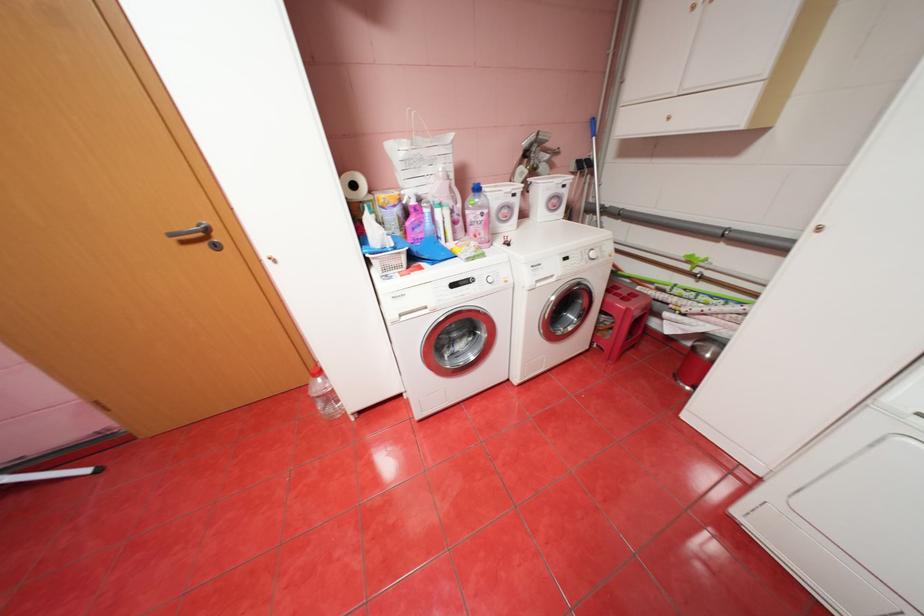
This screenshot has width=924, height=616. What do you see at coordinates (588, 301) in the screenshot?
I see `a washing machine door handle` at bounding box center [588, 301].